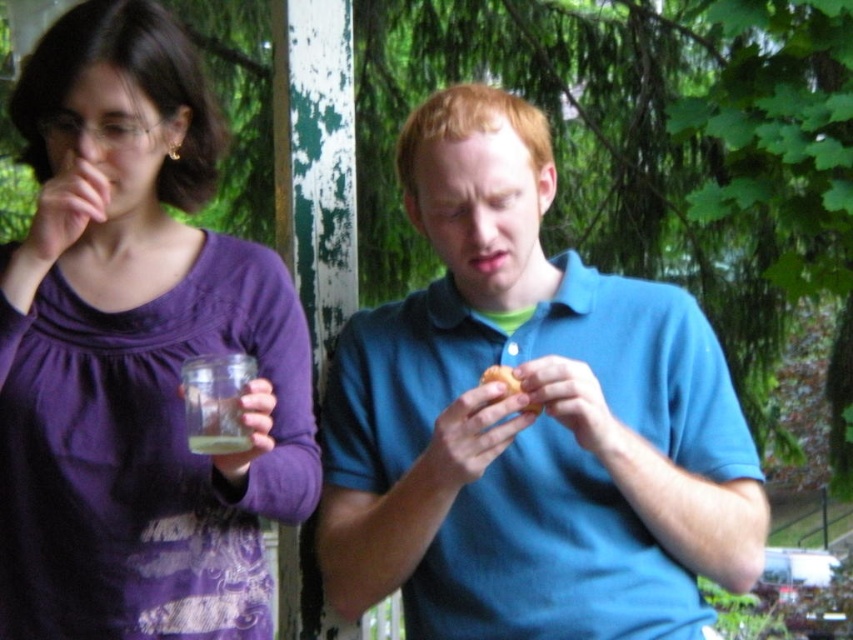
Question: Which point appears farthest from the camera in this image?

Choices:
 (A) (532, 576)
 (B) (497, 380)

Answer: (A)

Question: Which of the following is the farthest from the observer?

Choices:
 (A) (500, 371)
 (B) (36, 76)

Answer: (B)

Question: Does purple matte shirt at upper left come in front of yellow matte donut at center?

Choices:
 (A) yes
 (B) no

Answer: (A)

Question: Does purple matte shirt at upper left appear on the right side of yellow matte donut at center?

Choices:
 (A) no
 (B) yes

Answer: (A)

Question: In this image, where is blue cotton shirt at center located relative to purple matte shirt at upper left?

Choices:
 (A) left
 (B) right

Answer: (B)

Question: Which object is the closest to the purple matte shirt at upper left?

Choices:
 (A) blue cotton shirt at center
 (B) yellow matte donut at center

Answer: (A)